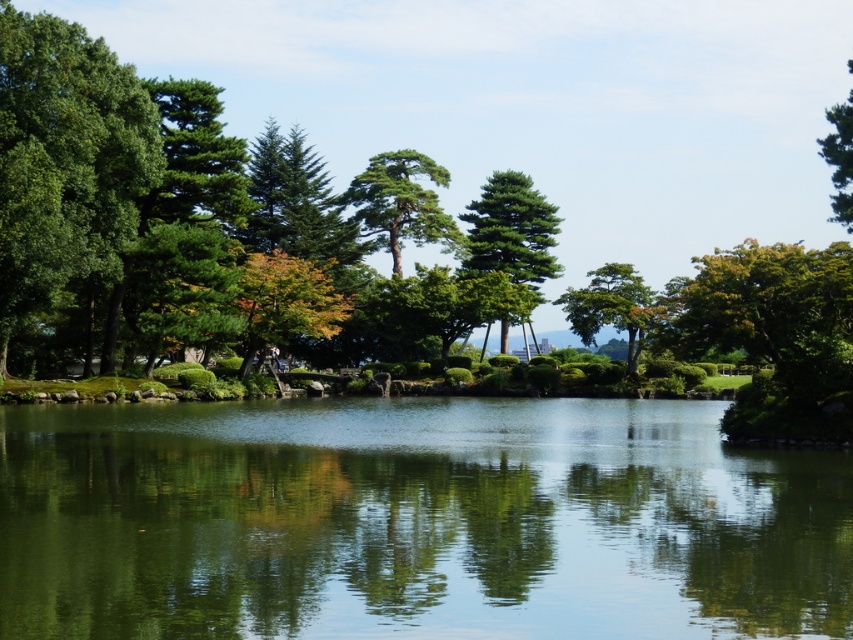
Question: Which object is closer to the camera taking this photo?

Choices:
 (A) green reflective water at center
 (B) green glossy tree at center
 (C) green matte tree at upper right
 (D) green needle-like tree at center

Answer: (A)

Question: Which object is the closest to the green matte tree at upper right?

Choices:
 (A) green leafy tree at left
 (B) green needle-like tree at center
 (C) green reflective water at center
 (D) green glossy tree at center

Answer: (D)

Question: Is green leafy tree at left above green glossy tree at center?

Choices:
 (A) no
 (B) yes

Answer: (B)

Question: Among these objects, which one is farthest from the camera?

Choices:
 (A) green reflective water at center
 (B) green textured pine tree at center

Answer: (B)

Question: Does green needle-like tree at center have a lesser width compared to green matte tree at upper right?

Choices:
 (A) no
 (B) yes

Answer: (B)

Question: Is green textured pine tree at center thinner than green glossy tree at center?

Choices:
 (A) no
 (B) yes

Answer: (A)